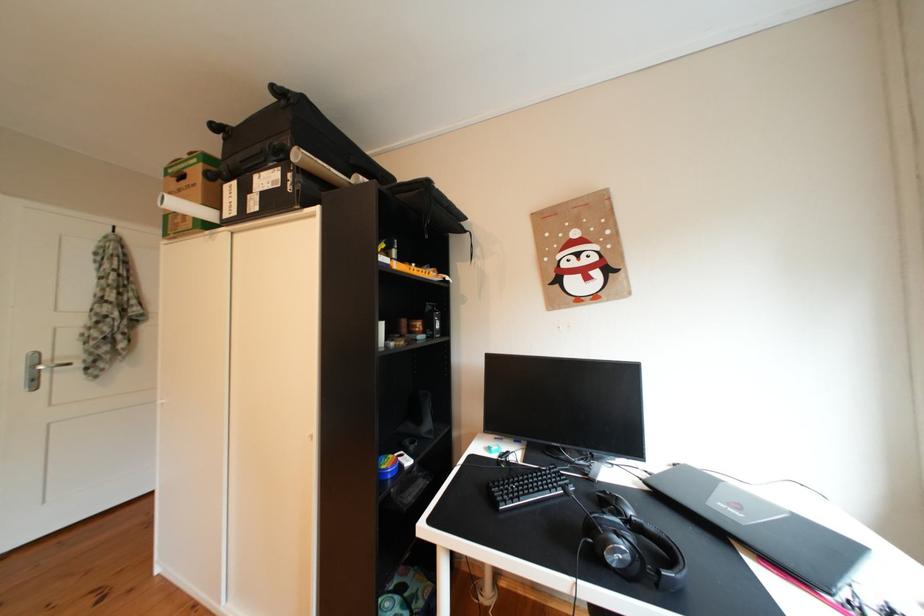
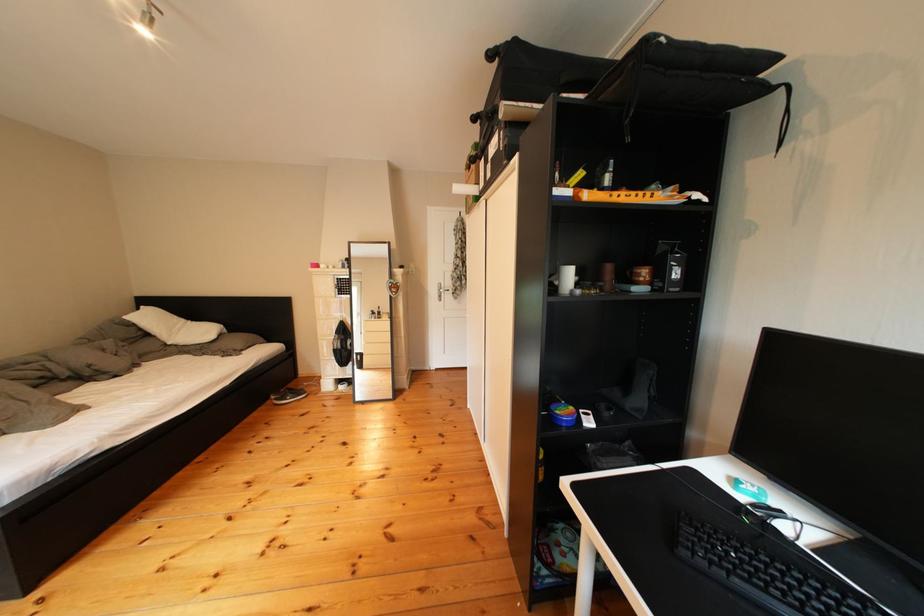
Find the pixel in the second image that matches [430,274] in the first image.

(638, 198)